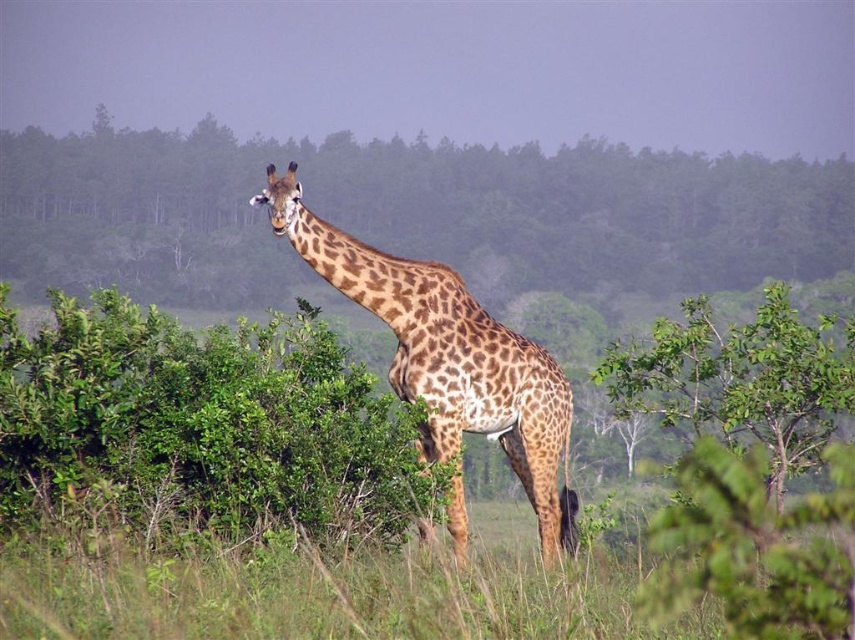
Which is behind, point (579, 278) or point (54, 440)?

The point (579, 278) is behind.

Can you confirm if green leafy tree at center is shorter than green leafy bush at center?

In fact, green leafy tree at center may be taller than green leafy bush at center.

Where is `green leafy tree at center`? The height and width of the screenshot is (640, 855). green leafy tree at center is located at coordinates (411, 212).

How much distance is there between green leafy bush at center and spotted fur giraffe at center?

A distance of 2.10 meters exists between green leafy bush at center and spotted fur giraffe at center.

Can you confirm if green leafy bush at center is wider than spotted fur giraffe at center?

In fact, green leafy bush at center might be narrower than spotted fur giraffe at center.

This screenshot has width=855, height=640. Find the location of `green leafy bush at center`. green leafy bush at center is located at coordinates (201, 426).

Which of these two, green leafy tree at center or spotted fur giraffe at center, stands taller?

Standing taller between the two is green leafy tree at center.

Does green leafy tree at center have a greater width compared to spotted fur giraffe at center?

Yes.

Is point (522, 228) positioned behind point (523, 436)?

That is True.

Locate an element on the screen. green leafy tree at center is located at coordinates (411, 212).